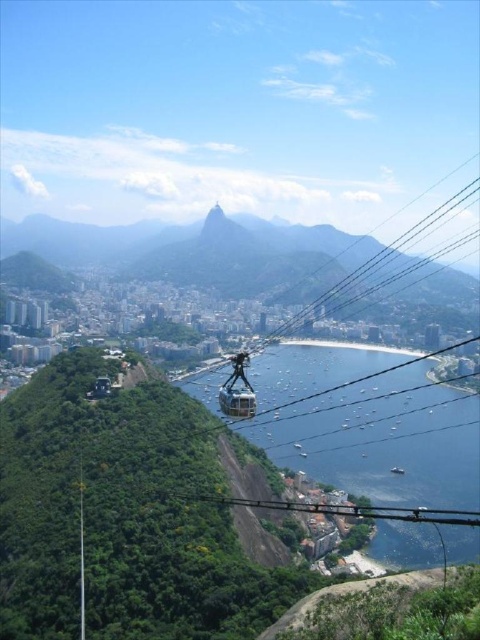
Question: Is green grassy mountain at center smaller than metallic cable car at center?

Choices:
 (A) no
 (B) yes

Answer: (A)

Question: Which of the following is the closest to the observer?

Choices:
 (A) green grassy mountain at center
 (B) metallic cable car at center

Answer: (B)

Question: Can you confirm if green grassy mountain at center is wider than metallic cable car at center?

Choices:
 (A) no
 (B) yes

Answer: (B)

Question: Is green grassy mountain at center thinner than metallic cable car at center?

Choices:
 (A) no
 (B) yes

Answer: (A)